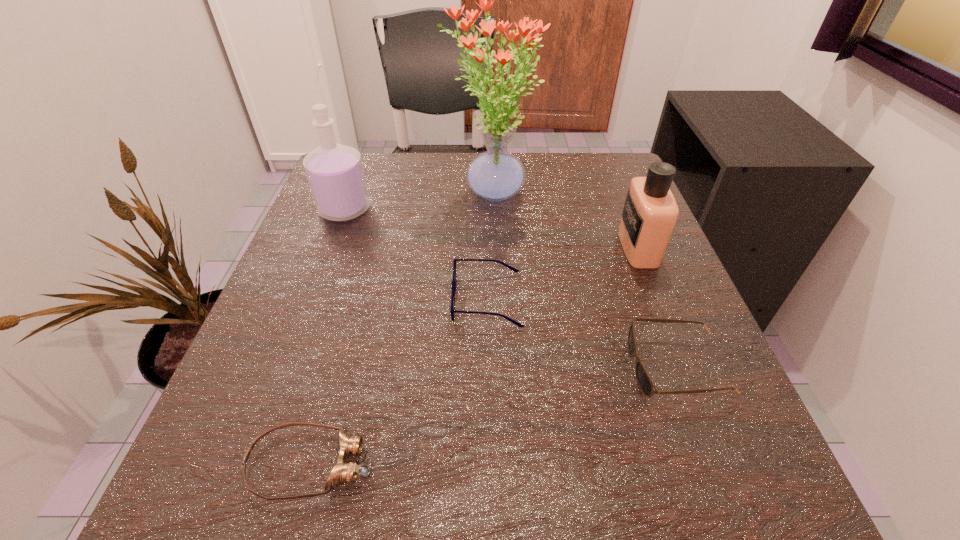
Locate an element on the screen. The height and width of the screenshot is (540, 960). vacant area that lies between the second nearest object and the tallest object is located at coordinates (584, 280).

The height and width of the screenshot is (540, 960). I want to click on free space between the farther perfume and the tallest object, so click(418, 201).

Identify the location of vacant space in between the goggles and the fourth shortest object. The width and height of the screenshot is (960, 540). (474, 355).

Image resolution: width=960 pixels, height=540 pixels. Identify the location of empty space between the left perfume and the tallest object. pos(418,201).

What are the coordinates of `free space between the shortest object and the tallest object` in the screenshot? It's located at (401, 328).

Locate an element on the screen. The image size is (960, 540). object that can be found as the third closest to the shortest object is located at coordinates (335, 173).

Locate an element on the screen. object that ranks as the fifth closest to the fifth farthest object is located at coordinates (335, 173).